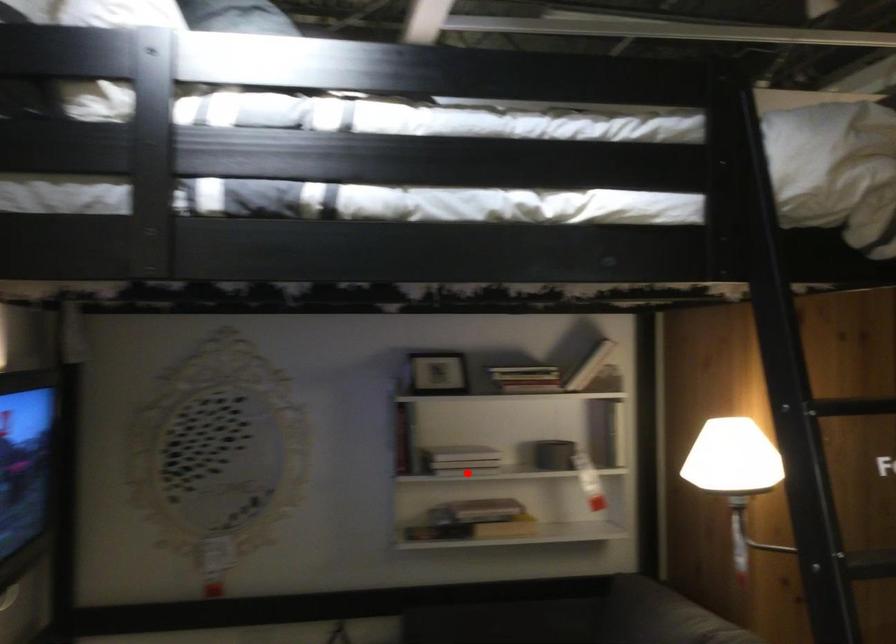
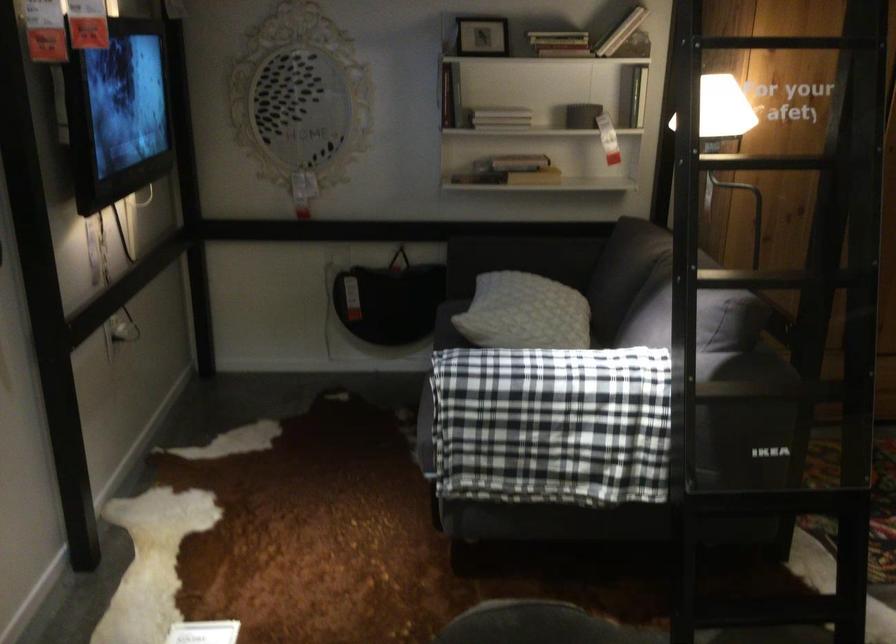
In the second image, find the point that corresponds to the highlighted location in the first image.

(500, 118)